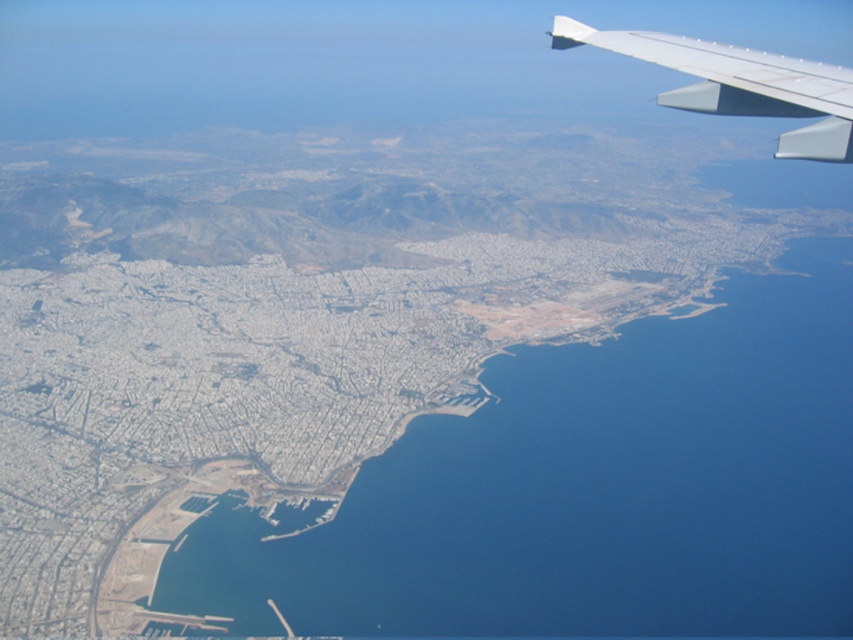
Based on the photo, who is lower down, blue water at lower left or white matte wing at upper right?

blue water at lower left is lower down.

Does blue water at lower left have a smaller size compared to white matte wing at upper right?

Yes.

Is point (440, 560) closer to viewer compared to point (703, 45)?

That is False.

The image size is (853, 640). Identify the location of blue water at lower left. (589, 490).